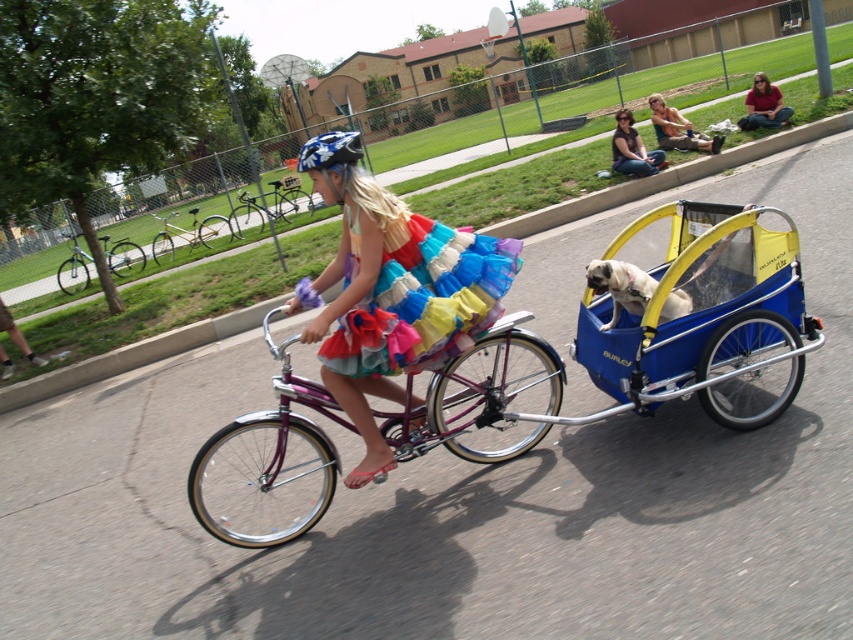
Question: Among these points, which one is farthest from the camera?

Choices:
 (A) 621,120
 (B) 341,148
 (C) 73,272
 (D) 669,140

Answer: (C)

Question: From the image, what is the correct spatial relationship of multicolored tulle dress at center in relation to matte red shirt at upper right?

Choices:
 (A) right
 (B) left

Answer: (B)

Question: Can you confirm if shiny purple bicycle at center is smaller than shiny silver bicycle at center?

Choices:
 (A) yes
 (B) no

Answer: (A)

Question: Does multicolored tulle dress at center come in front of denim shorts at lower right?

Choices:
 (A) yes
 (B) no

Answer: (A)

Question: Which of the following is the closest to the observer?

Choices:
 (A) silver metallic bicycle at center
 (B) blue plastic baby carriage at right

Answer: (B)

Question: Which is farther from the matte black sunglasses at upper center?

Choices:
 (A) multicolored tulle skirt at center
 (B) denim shorts at lower right
 (C) shiny purple bicycle at center

Answer: (A)